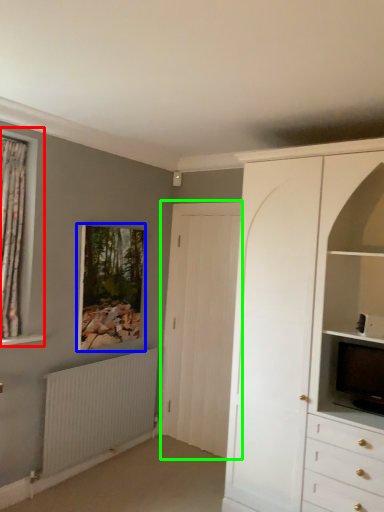
Question: Considering the real-world distances, which object is farthest from window (highlighted by a red box)? picture frame (highlighted by a blue box) or door (highlighted by a green box)?

Choices:
 (A) picture frame
 (B) door

Answer: (B)